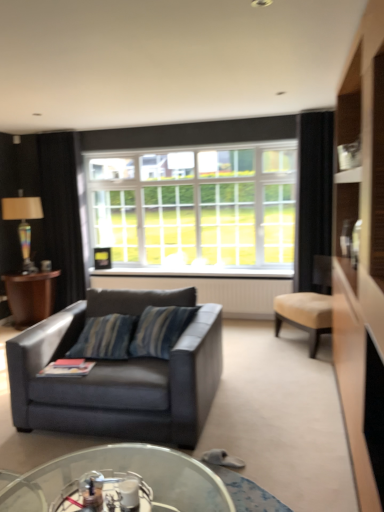
What is the approximate width of transparent glass coffee table at lower center?

transparent glass coffee table at lower center is 4.42 feet in width.

What is the approximate height of white glass window at center?

It is 4.89 feet.

What is the approximate width of wooden side table at left?

26.95 inches.

Where is `wooden side table at left`? wooden side table at left is located at coordinates click(30, 296).

Locate an element on the screen. multicolored glass lamp at left is located at coordinates (23, 223).

Locate an element on the screen. This screenshot has width=384, height=512. beige fabric ottoman at right is located at coordinates (308, 306).

Where is `leather couch at lower left`? The image size is (384, 512). leather couch at lower left is located at coordinates (119, 375).

Based on the photo, from a real-world perspective, is black fabric curtain at left, the 2th curtain when ordered from front to back, positioned above or below wooden side table at left?

Clearly, from a real-world perspective, black fabric curtain at left, the 2th curtain when ordered from front to back, is above wooden side table at left.

Considering the sizes of objects black fabric curtain at left, the 2th curtain when ordered from front to back, and wooden side table at left in the image provided, who is bigger, black fabric curtain at left, the 2th curtain when ordered from front to back, or wooden side table at left?

With larger size is black fabric curtain at left, the 2th curtain when ordered from front to back.

Is point (58, 300) closer to camera compared to point (20, 284)?

No, (58, 300) is behind (20, 284).

Is wooden side table at left facing away from white textured radiator at center?

No, wooden side table at left's orientation is not away from white textured radiator at center.

Image resolution: width=384 pixels, height=512 pixels. I want to click on table that is in front of the white textured radiator at center, so coord(30,296).

From the image's perspective, which one is positioned higher, wooden side table at left or white textured radiator at center?

white textured radiator at center, from the image's perspective.

Between beige fabric ottoman at right and white glass window at center, which one has smaller size?

Smaller between the two is beige fabric ottoman at right.

At what (x,y) coordinates should I click in order to perform the action: click on window behind the beige fabric ottoman at right. Please return your answer as a coordinate pair (x, y). This screenshot has width=384, height=512. Looking at the image, I should click on (196, 208).

How distant is beige fabric ottoman at right from white glass window at center?

beige fabric ottoman at right is 6.70 feet away from white glass window at center.

Who is shorter, transparent glass coffee table at lower center or beige fabric ottoman at right?

transparent glass coffee table at lower center.

Is beige fabric ottoman at right at the back of transparent glass coffee table at lower center?

No, beige fabric ottoman at right is not at the back of transparent glass coffee table at lower center.

Is transparent glass coffee table at lower center inside the boundaries of beige fabric ottoman at right, or outside?

transparent glass coffee table at lower center lies outside beige fabric ottoman at right.

Are wooden side table at left and transparent glass coffee table at lower center far apart?

That's right, there is a large distance between wooden side table at left and transparent glass coffee table at lower center.

From the image's perspective, which one is positioned higher, wooden side table at left or transparent glass coffee table at lower center?

wooden side table at left appears higher in the image.

Can you confirm if wooden side table at left is positioned to the right of transparent glass coffee table at lower center?

No, wooden side table at left is not to the right of transparent glass coffee table at lower center.

Based on the photo, how different are the orientations of black fabric curtain at right, acting as the second curtain starting from the left, and black fabric curtain at left, positioned as the second curtain in right-to-left order, in degrees?

The facing directions of black fabric curtain at right, acting as the second curtain starting from the left, and black fabric curtain at left, positioned as the second curtain in right-to-left order, are 0.643 degrees apart.

Looking at the image, does black fabric curtain at right, the 2th curtain viewed from the back, seem bigger or smaller compared to black fabric curtain at left, positioned as the second curtain in right-to-left order?

Clearly, black fabric curtain at right, the 2th curtain viewed from the back, is smaller in size than black fabric curtain at left, positioned as the second curtain in right-to-left order.

Who is shorter, black fabric curtain at right, placed as the 1th curtain when sorted from right to left, or black fabric curtain at left, arranged as the 1th curtain when viewed from the left?

black fabric curtain at right, placed as the 1th curtain when sorted from right to left.

Find the location of a particular element. The image size is (384, 512). curtain above the black fabric curtain at left, positioned as the second curtain in right-to-left order (from the image's perspective) is located at coordinates (313, 193).

Who is smaller, multicolored glass lamp at left or transparent glass coffee table at lower center?

With smaller size is multicolored glass lamp at left.

Considering the positions of points (23, 208) and (178, 506), is point (23, 208) farther from camera compared to point (178, 506)?

Yes, it is behind point (178, 506).

Measure the distance from multicolored glass lamp at left to transparent glass coffee table at lower center.

A distance of 3.70 meters exists between multicolored glass lamp at left and transparent glass coffee table at lower center.

Where is `curtain that is the 1st one when counting rightward from the wooden side table at left`? curtain that is the 1st one when counting rightward from the wooden side table at left is located at coordinates (64, 212).

Where is `table lying in front of the white textured radiator at center`? The height and width of the screenshot is (512, 384). table lying in front of the white textured radiator at center is located at coordinates (30, 296).

Estimate the real-world distances between objects in this image. Which object is further from multicolored glass lamp at left, black fabric curtain at right, the 1th curtain viewed from the front, or black fabric curtain at left, the 2th curtain when ordered from front to back?

black fabric curtain at right, the 1th curtain viewed from the front.

Looking at the image, which one is located further to beige fabric ottoman at right, black fabric curtain at left, placed as the 1th curtain when sorted from back to front, or wooden side table at left?

black fabric curtain at left, placed as the 1th curtain when sorted from back to front, is further to beige fabric ottoman at right.

Considering their positions, is leather couch at lower left positioned closer to transparent glass coffee table at lower center than beige fabric ottoman at right?

leather couch at lower left is closer to transparent glass coffee table at lower center.

Looking at the image, which one is located closer to black fabric curtain at left, positioned as the second curtain in right-to-left order, white glass window at center or leather couch at lower left?

white glass window at center is closer to black fabric curtain at left, positioned as the second curtain in right-to-left order.

Looking at the image, which one is located further to multicolored glass lamp at left, white glass window at center or black fabric curtain at right, the 2th curtain viewed from the back?

Among the two, black fabric curtain at right, the 2th curtain viewed from the back, is located further to multicolored glass lamp at left.

Based on their spatial positions, is black fabric curtain at left, the 2th curtain when ordered from front to back, or white glass window at center further from multicolored glass lamp at left?

white glass window at center lies further to multicolored glass lamp at left than the other object.

When comparing their distances from black fabric curtain at right, the 1th curtain viewed from the front, does leather couch at lower left or black fabric curtain at left, arranged as the 1th curtain when viewed from the left, seem further?

black fabric curtain at left, arranged as the 1th curtain when viewed from the left.

Considering their positions, is black fabric curtain at left, positioned as the second curtain in right-to-left order, positioned further to leather couch at lower left than transparent glass coffee table at lower center?

The object further to leather couch at lower left is black fabric curtain at left, positioned as the second curtain in right-to-left order.

You are a GUI agent. You are given a task and a screenshot of the screen. Output one action in this format:
    pyautogui.click(x=<x>, y=<y>)
    Task: Click on the curtain between wooden side table at left and white glass window at center
    
    Given the screenshot: What is the action you would take?
    64,212

I want to click on table between transparent glass coffee table at lower center and black fabric curtain at left, the 2th curtain when ordered from front to back, from front to back, so click(30, 296).

Where is `window between multicolored glass lamp at left and beige fabric ottoman at right from left to right`? window between multicolored glass lamp at left and beige fabric ottoman at right from left to right is located at coordinates (196, 208).

Identify the location of chair situated between white glass window at center and black fabric curtain at right, the 2th curtain viewed from the back, from left to right. Image resolution: width=384 pixels, height=512 pixels. (308, 306).